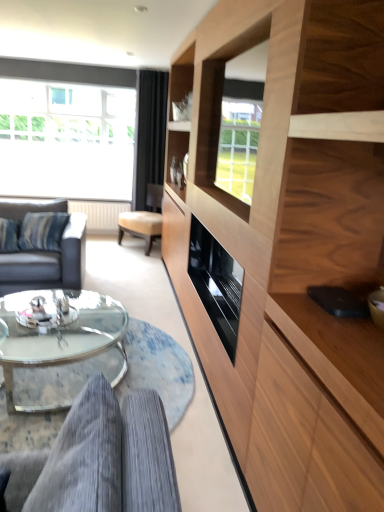
What is the approximate height of wooden cabinet at right?

2.33 meters.

What is the approximate width of black velvet curtain at upper center?

The width of black velvet curtain at upper center is 7.70 inches.

Where is `clear glass coffee table at lower center`? clear glass coffee table at lower center is located at coordinates (58, 334).

Find the location of a particular element. The image size is (384, 512). wooden cabinet at right is located at coordinates (291, 245).

Looking at this image, is transparent glass window at upper left looking in the opposite direction of dark gray leather couch at left, which appears as the second studio couch when ordered from the bottom?

That's not correct — transparent glass window at upper left is not looking away from dark gray leather couch at left, which appears as the second studio couch when ordered from the bottom.

Considering the relative sizes of transparent glass window at upper left and dark gray leather couch at left, acting as the first studio couch starting from the left, in the image provided, is transparent glass window at upper left wider than dark gray leather couch at left, acting as the first studio couch starting from the left,?

No, transparent glass window at upper left is not wider than dark gray leather couch at left, acting as the first studio couch starting from the left.

Find the location of a particular element. The height and width of the screenshot is (512, 384). the 1st studio couch counting from the right side of the transparent glass window at upper left is located at coordinates (48, 263).

From the image's perspective, is transparent glass window at upper left positioned above or below dark gray leather couch at left, which appears as the second studio couch when ordered from the bottom?

Clearly, from the image's perspective, transparent glass window at upper left is above dark gray leather couch at left, which appears as the second studio couch when ordered from the bottom.

Which is behind, wooden cabinet at right or black velvet curtain at upper center?

Positioned behind is black velvet curtain at upper center.

Consider the image. How many degrees apart are the facing directions of wooden cabinet at right and black velvet curtain at upper center?

90 degrees.

From the image's perspective, which is below, wooden cabinet at right or black velvet curtain at upper center?

wooden cabinet at right appears lower in the image.

Between wooden cabinet at right and black velvet curtain at upper center, which one has larger width?

Wider between the two is wooden cabinet at right.

Would you consider black velvet curtain at upper center to be distant from gray corduroy couch at lower left, the first studio couch in the bottom-to-top sequence?

Yes, black velvet curtain at upper center and gray corduroy couch at lower left, the first studio couch in the bottom-to-top sequence, are located far from each other.

Considering the positions of objects black velvet curtain at upper center and gray corduroy couch at lower left, the first studio couch in the front-to-back sequence, in the image provided, who is more to the right, black velvet curtain at upper center or gray corduroy couch at lower left, the first studio couch in the front-to-back sequence,?

gray corduroy couch at lower left, the first studio couch in the front-to-back sequence.

Considering the sizes of black velvet curtain at upper center and gray corduroy couch at lower left, the first studio couch in the front-to-back sequence, in the image, is black velvet curtain at upper center wider or thinner than gray corduroy couch at lower left, the first studio couch in the front-to-back sequence,?

Clearly, black velvet curtain at upper center has less width compared to gray corduroy couch at lower left, the first studio couch in the front-to-back sequence.

Are wooden cabinet at right and transparent glass window at upper left beside each other?

wooden cabinet at right is not next to transparent glass window at upper left, and they're not touching.

This screenshot has width=384, height=512. What are the coordinates of `window on the left of wooden cabinet at right` in the screenshot? It's located at (66, 129).

Can you confirm if wooden cabinet at right is thinner than transparent glass window at upper left?

Incorrect, the width of wooden cabinet at right is not less than that of transparent glass window at upper left.

Looking at this image, from a real-world perspective, which is physically above, wooden cabinet at right or transparent glass window at upper left?

In real-world perspective, transparent glass window at upper left is above.

Is transparent glass window at upper left smaller than black velvet curtain at upper center?

Incorrect, transparent glass window at upper left is not smaller in size than black velvet curtain at upper center.

Would you say black velvet curtain at upper center is part of transparent glass window at upper left's contents?

Definitely not — black velvet curtain at upper center is not inside transparent glass window at upper left.

The image size is (384, 512). Identify the location of window above the black velvet curtain at upper center (from a real-world perspective). (66, 129).

Which is nearer, (67, 168) or (150, 132)?

Point (67, 168).

From a real-world perspective, is black velvet curtain at upper center over dark gray leather couch at left, which appears as the second studio couch when ordered from the bottom?

Indeed, from a real-world perspective, black velvet curtain at upper center stands above dark gray leather couch at left, which appears as the second studio couch when ordered from the bottom.

Is black velvet curtain at upper center oriented towards dark gray leather couch at left, acting as the first studio couch starting from the left?

No, black velvet curtain at upper center is not facing towards dark gray leather couch at left, acting as the first studio couch starting from the left.

Can you tell me how much black velvet curtain at upper center and dark gray leather couch at left, arranged as the second studio couch when viewed from the front, differ in facing direction?

1.52 degrees separate the facing orientations of black velvet curtain at upper center and dark gray leather couch at left, arranged as the second studio couch when viewed from the front.

Relative to dark gray leather couch at left, arranged as the second studio couch when viewed from the front, is black velvet curtain at upper center in front or behind?

Visually, black velvet curtain at upper center is located behind dark gray leather couch at left, arranged as the second studio couch when viewed from the front.

Does wooden cabinet at right have a greater height compared to clear glass coffee table at lower center?

Yes, wooden cabinet at right is taller than clear glass coffee table at lower center.

Which object is positioned more to the left, wooden cabinet at right or clear glass coffee table at lower center?

Positioned to the left is clear glass coffee table at lower center.

At what (x,y) coordinates should I click in order to perform the action: click on coffee table that is under the wooden cabinet at right (from a real-world perspective). Please return your answer as a coordinate pair (x, y). Looking at the image, I should click on (58, 334).

Are wooden cabinet at right and clear glass coffee table at lower center far apart?

Yes, wooden cabinet at right is far from clear glass coffee table at lower center.

This screenshot has height=512, width=384. In order to click on studio couch that is the 1st object located in front of the transparent glass window at upper left in this screenshot , I will do `click(48, 263)`.

At what (x,y) coordinates should I click in order to perform the action: click on cabinetry below the black velvet curtain at upper center (from the image's perspective). Please return your answer as a coordinate pair (x, y). Looking at the image, I should click on (291, 245).

Based on their spatial positions, is transparent glass window at upper left or dark gray leather couch at left, which appears as the second studio couch when ordered from the bottom, further from clear glass coffee table at lower center?

transparent glass window at upper left.

Based on their spatial positions, is wooden cabinet at right or clear glass coffee table at lower center further from black velvet curtain at upper center?

wooden cabinet at right.

Considering their positions, is transparent glass window at upper left positioned further to black velvet curtain at upper center than gray corduroy couch at lower left, arranged as the 2th studio couch when viewed from the left?

gray corduroy couch at lower left, arranged as the 2th studio couch when viewed from the left.

Considering their positions, is clear glass coffee table at lower center positioned closer to black velvet curtain at upper center than dark gray leather couch at left, which appears as the second studio couch when ordered from the bottom?

Among the two, dark gray leather couch at left, which appears as the second studio couch when ordered from the bottom, is located nearer to black velvet curtain at upper center.

Considering their positions, is wooden cabinet at right positioned further to black velvet curtain at upper center than dark gray leather couch at left, the 1th studio couch from the top?

wooden cabinet at right is further to black velvet curtain at upper center.

Which object lies further to the anchor point wooden cabinet at right, clear glass coffee table at lower center or transparent glass window at upper left?

transparent glass window at upper left is further to wooden cabinet at right.

Which object lies nearer to the anchor point transparent glass window at upper left, clear glass coffee table at lower center or wooden cabinet at right?

clear glass coffee table at lower center is closer to transparent glass window at upper left.

Looking at the image, which one is located further to clear glass coffee table at lower center, dark gray leather couch at left, which appears as the second studio couch when ordered from the bottom, or black velvet curtain at upper center?

The object further to clear glass coffee table at lower center is black velvet curtain at upper center.

The height and width of the screenshot is (512, 384). I want to click on coffee table located between gray corduroy couch at lower left, the first studio couch in the front-to-back sequence, and transparent glass window at upper left in the depth direction, so click(58, 334).

What are the coordinates of `studio couch positioned between gray corduroy couch at lower left, the first studio couch in the front-to-back sequence, and transparent glass window at upper left from near to far` in the screenshot? It's located at (48, 263).

You are a GUI agent. You are given a task and a screenshot of the screen. Output one action in this format:
    pyautogui.click(x=<x>, y=<y>)
    Task: Click on the window between wooden cabinet at right and black velvet curtain at upper center in the front-back direction
    The width and height of the screenshot is (384, 512).
    Given the screenshot: What is the action you would take?
    pyautogui.click(x=66, y=129)

You are a GUI agent. You are given a task and a screenshot of the screen. Output one action in this format:
    pyautogui.click(x=<x>, y=<y>)
    Task: Click on the studio couch located between clear glass coffee table at lower center and transparent glass window at upper left in the depth direction
    This screenshot has height=512, width=384.
    Given the screenshot: What is the action you would take?
    pyautogui.click(x=48, y=263)